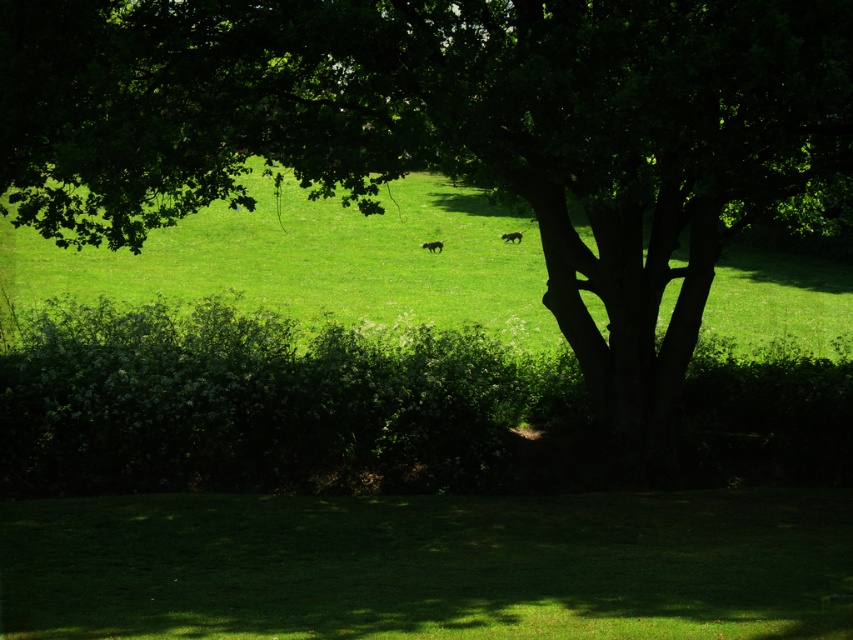
Which of these two, green leafy tree at center or green leafy hedge at lower center, stands shorter?

green leafy hedge at lower center is shorter.

Who is positioned more to the left, green leafy tree at center or green leafy hedge at lower center?

green leafy hedge at lower center

The height and width of the screenshot is (640, 853). I want to click on green leafy tree at center, so click(451, 132).

Identify the location of green leafy tree at center. (451, 132).

Does green leafy tree at center have a lesser height compared to black fur dog at center?

In fact, green leafy tree at center may be taller than black fur dog at center.

Does green leafy tree at center have a larger size compared to black fur dog at center?

Correct, green leafy tree at center is larger in size than black fur dog at center.

What do you see at coordinates (451, 132) in the screenshot? I see `green leafy tree at center` at bounding box center [451, 132].

At what (x,y) coordinates should I click in order to perform the action: click on green leafy tree at center. Please return your answer as a coordinate pair (x, y). This screenshot has width=853, height=640. Looking at the image, I should click on (451, 132).

Is green leafy tree at center shorter than green grassy field at center?

Yes.

Who is higher up, green leafy tree at center or green grassy field at center?

green grassy field at center is above.

Identify the location of green leafy tree at center. (451, 132).